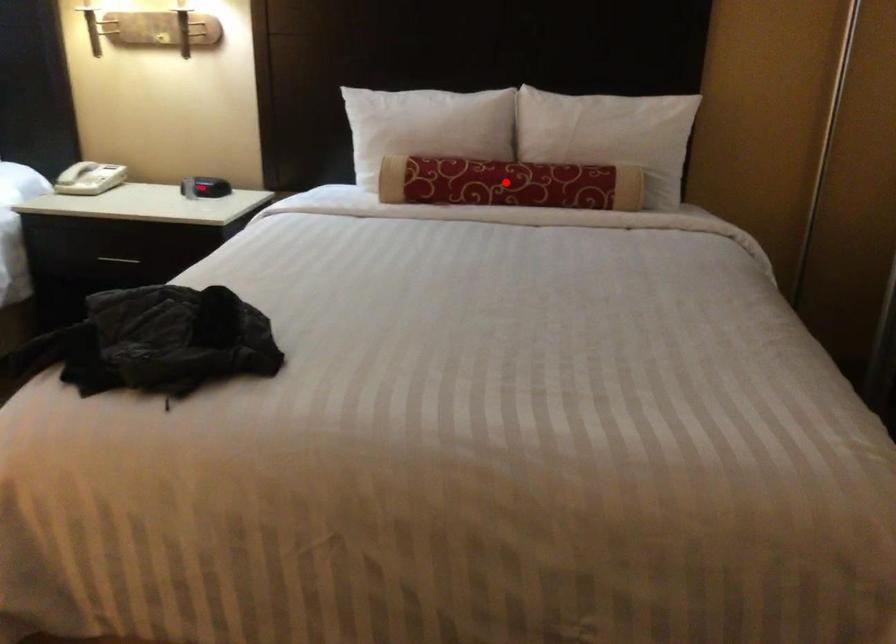
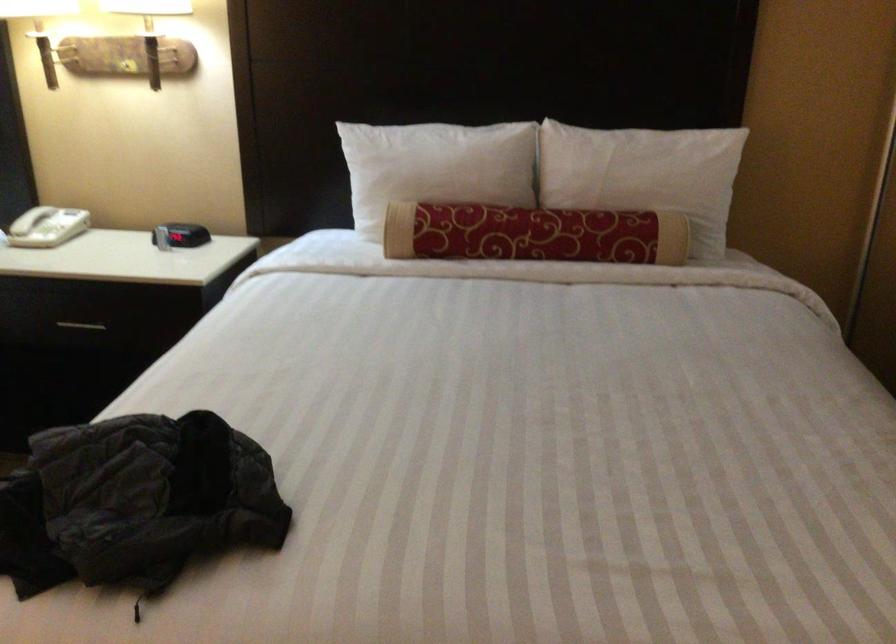
Question: I am providing you with two images of the same scene from different viewpoints. In image1, a red point is highlighted. Considering the same 3D point in image2, which of the following is correct?

Choices:
 (A) It is closer
 (B) It is farther

Answer: (A)